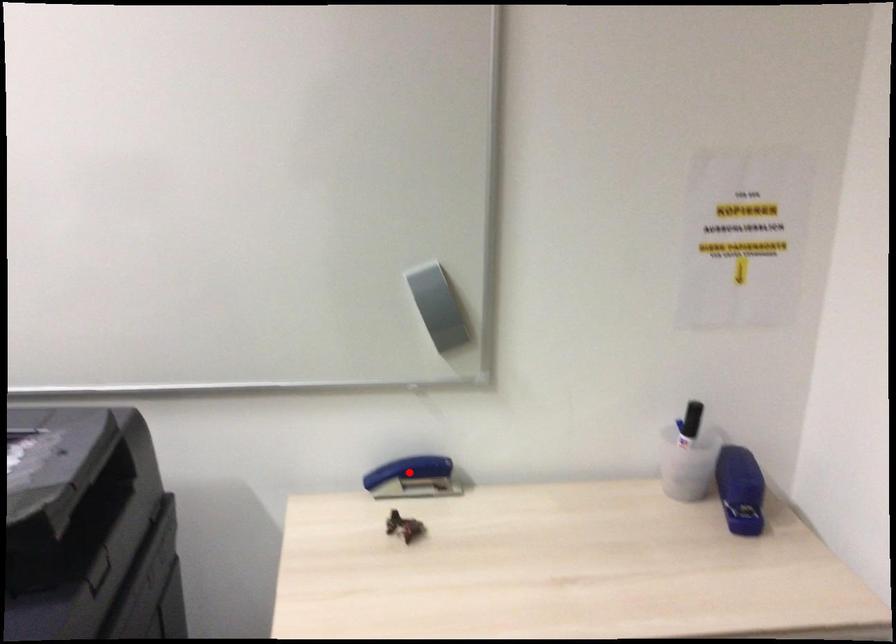
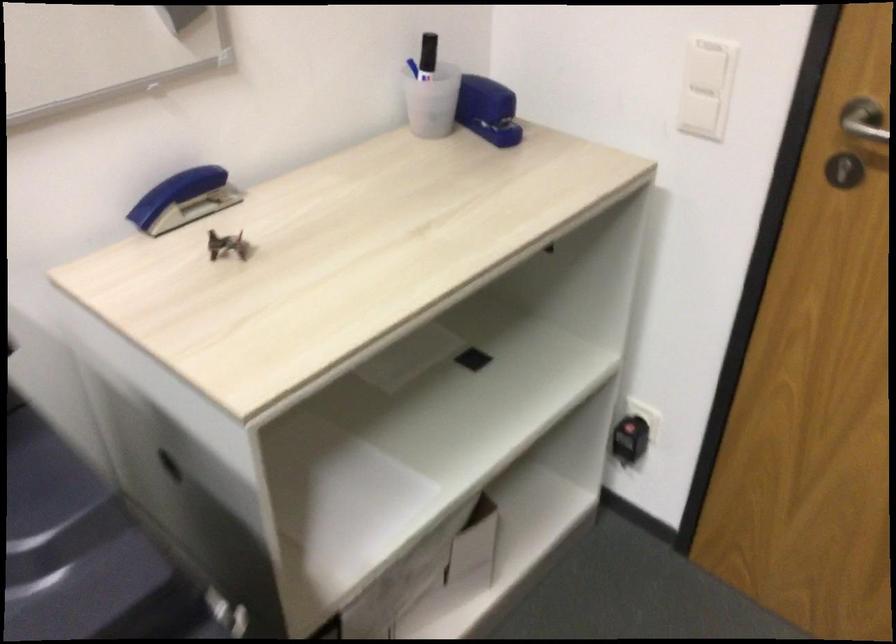
The point at the highlighted location is marked in the first image. Where is the corresponding point in the second image?

(184, 199)